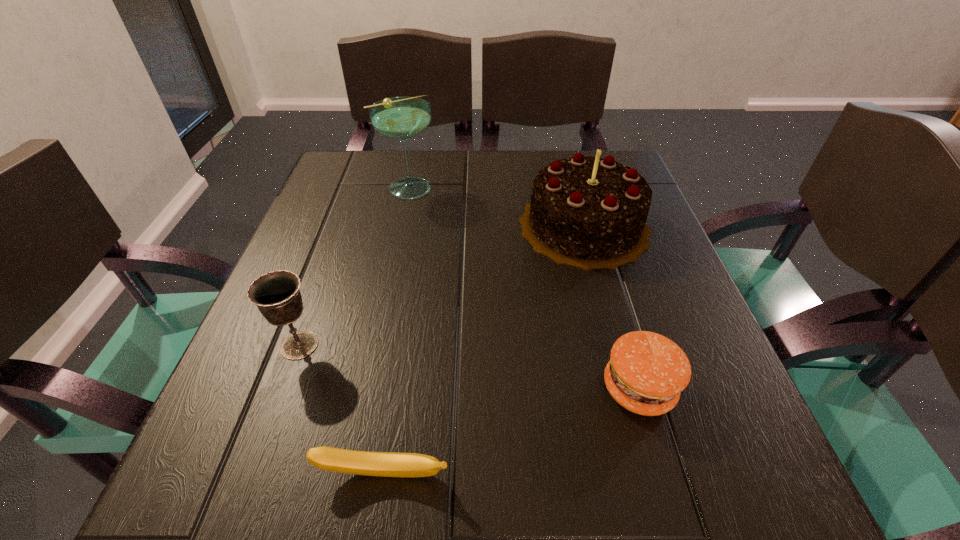
This screenshot has height=540, width=960. Identify the location of vacant space at the far edge of the desktop. (456, 151).

Find the location of `vacant space at the left edge of the desktop`. vacant space at the left edge of the desktop is located at coordinates (342, 326).

Find the location of a particular element. This screenshot has width=960, height=540. vacant space at the right edge of the desktop is located at coordinates (661, 290).

Locate an element on the screen. The image size is (960, 540). free area in between the shortest object and the birthday cake is located at coordinates (484, 350).

At what (x,y) coordinates should I click in order to perform the action: click on free space that is in between the patty and the birthday cake. Please return your answer as a coordinate pair (x, y). Looking at the image, I should click on (612, 307).

I want to click on vacant area between the shortest object and the martini, so click(x=396, y=331).

Where is `empty space that is in between the birthday cake and the second shortest object`? This screenshot has height=540, width=960. empty space that is in between the birthday cake and the second shortest object is located at coordinates (612, 307).

The height and width of the screenshot is (540, 960). Find the location of `free spot between the martini and the birthday cake`. free spot between the martini and the birthday cake is located at coordinates (496, 207).

The width and height of the screenshot is (960, 540). In order to click on vacant space that's between the fourth tallest object and the birthday cake in this screenshot , I will do `click(612, 307)`.

Where is `vacant space in between the birthday cake and the chalice`? vacant space in between the birthday cake and the chalice is located at coordinates (442, 286).